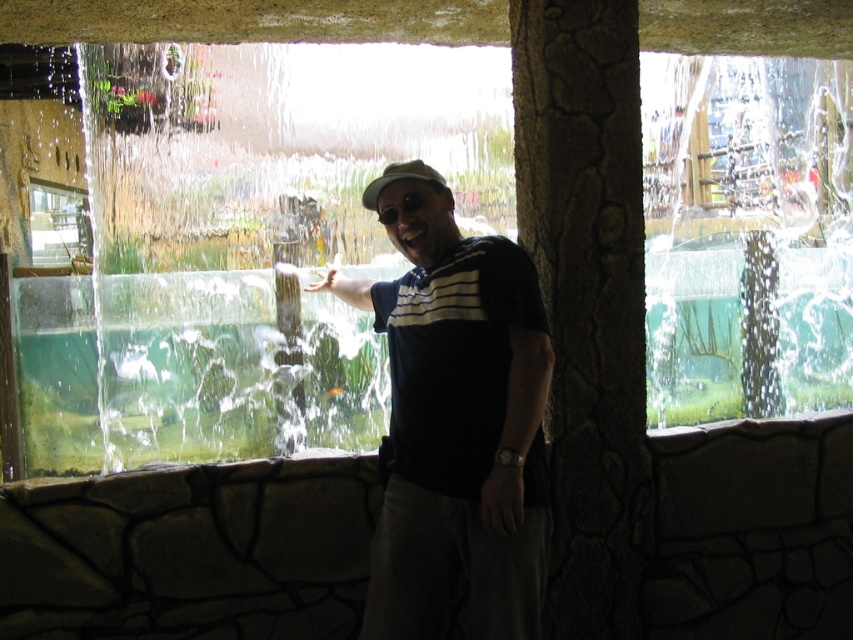
You are a photographer trying to capture a clear shot of the man and the clear glass water at center. Since the beige fabric baseball cap at center might block the view, can you confirm if the cap is smaller than the water area in the image?

The clear glass water at center is larger in size than the beige fabric baseball cap at center, so the cap is smaller and less likely to block the entire water area in the image.